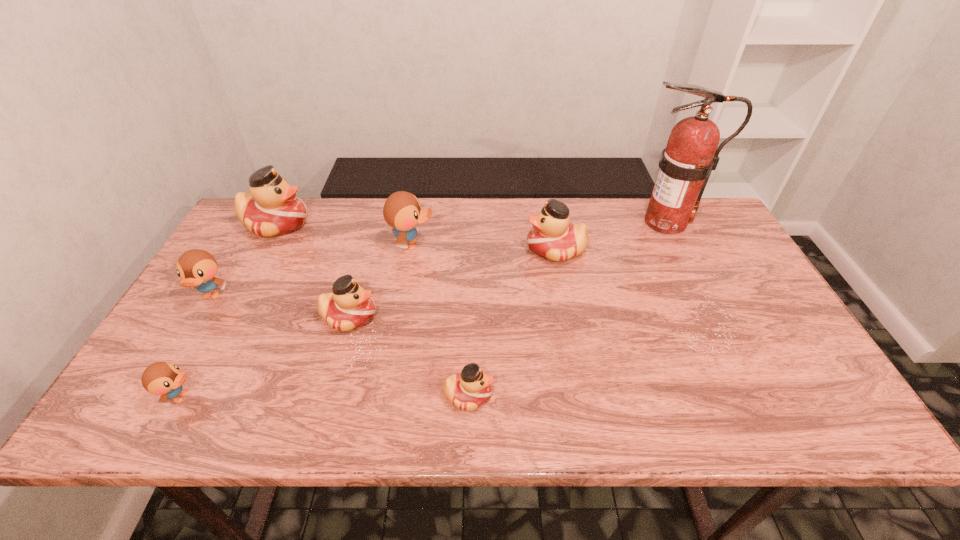
The height and width of the screenshot is (540, 960). Identify the location of empty space between the rightmost object and the second farthest blue duck. (439, 259).

I want to click on free space that is in between the sixth object from left to right and the rightmost duck, so click(x=512, y=322).

Where is `free spot between the seventh object from left to right and the farthest blue duck`? free spot between the seventh object from left to right and the farthest blue duck is located at coordinates (484, 247).

The image size is (960, 540). I want to click on vacant space in between the rightmost duck and the tallest object, so point(611,236).

You are a GUI agent. You are given a task and a screenshot of the screen. Output one action in this format:
    pyautogui.click(x=<x>, y=<y>)
    Task: Click on the sixth closest object to the smallest red duck
    
    Given the screenshot: What is the action you would take?
    click(272, 208)

The image size is (960, 540). In order to click on object that is the third closest to the seventh object from left to right in this screenshot , I will do `click(471, 388)`.

Locate which duck is the closest to the tallest object. Please provide its 2D coordinates. Your answer should be formatted as a tuple, i.e. [(x, y)], where the tuple contains the x and y coordinates of a point satisfying the conditions above.

[(552, 237)]

Find the location of a particular element. duck that stands as the fourth closest to the third red duck from right to left is located at coordinates (197, 268).

Point out which red duck is positioned as the nearest to the fire extinguisher. Please provide its 2D coordinates. Your answer should be formatted as a tuple, i.e. [(x, y)], where the tuple contains the x and y coordinates of a point satisfying the conditions above.

[(552, 237)]

In order to click on red duck that is the second closest one to the second red duck from left to right in this screenshot , I will do `click(272, 208)`.